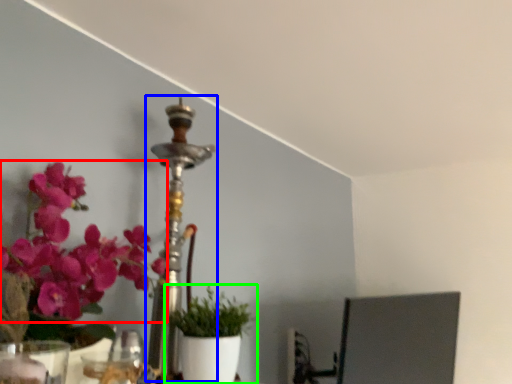
Question: Estimate the real-world distances between objects in this image. Which object is farther from flower (highlighted by a red box), candle holder (highlighted by a blue box) or houseplant (highlighted by a green box)?

Choices:
 (A) candle holder
 (B) houseplant

Answer: (B)